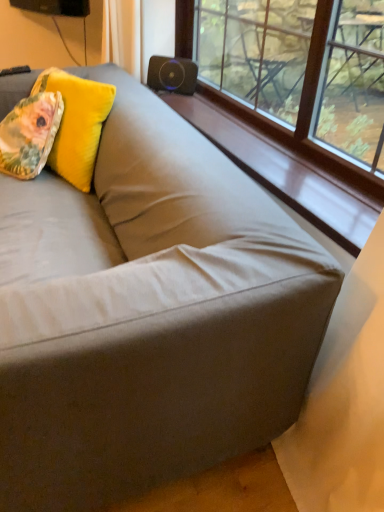
Question: Is point (183, 82) positioned closer to the camera than point (8, 128)?

Choices:
 (A) farther
 (B) closer

Answer: (A)

Question: Considering their positions, is black matte speaker at upper center located in front of or behind floral fabric pillow at upper left, the first throw pillow in the front-to-back sequence?

Choices:
 (A) front
 (B) behind

Answer: (B)

Question: Which object is positioned closest to the floral fabric pillow at upper left, the 2th throw pillow when ordered from back to front?

Choices:
 (A) fluffy yellow pillow at upper left, which appears as the 1th throw pillow when viewed from the back
 (B) black matte speaker at upper center
 (C) wooden at upper center

Answer: (A)

Question: Which object is positioned farthest from the wooden at upper center?

Choices:
 (A) black matte speaker at upper center
 (B) floral fabric pillow at upper left, the 2th throw pillow when ordered from back to front
 (C) fluffy yellow pillow at upper left, which appears as the 1th throw pillow when viewed from the back

Answer: (B)